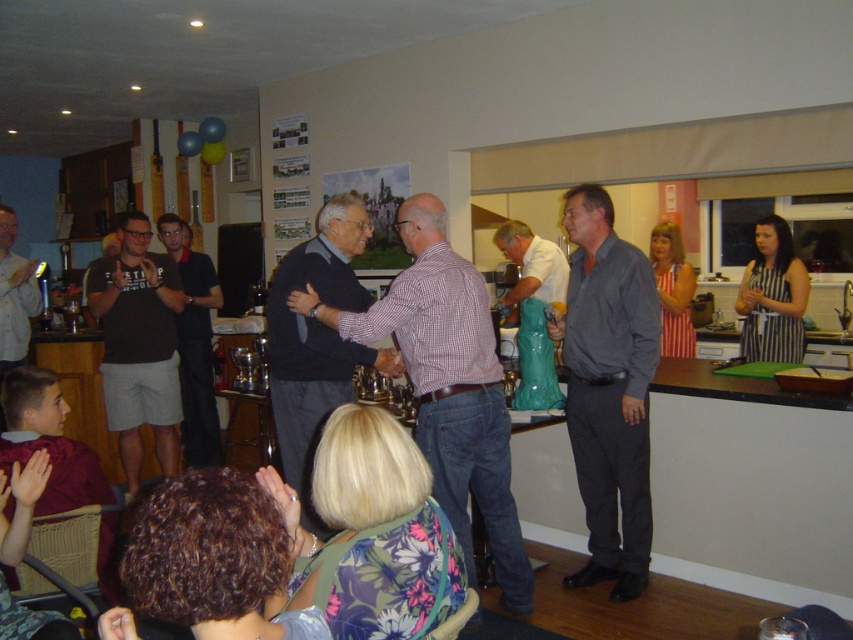
Question: Can you confirm if dark gray sweater at center is positioned below black cotton t-shirt at left?

Choices:
 (A) yes
 (B) no

Answer: (A)

Question: Among these points, which one is farthest from the camera?

Choices:
 (A) (553, 262)
 (B) (624, 314)
 (C) (27, 333)
 (D) (422, 209)

Answer: (C)

Question: From the image, what is the correct spatial relationship of checkered fabric shirt at center in relation to black cotton t-shirt at center?

Choices:
 (A) above
 (B) below

Answer: (B)

Question: Which object is closer to the camera taking this photo?

Choices:
 (A) light brown shirt at lower left
 (B) black cotton t-shirt at center

Answer: (A)

Question: Which point appears farthest from the camera in this image?

Choices:
 (A) (3, 301)
 (B) (612, 483)
 (C) (509, 493)

Answer: (A)

Question: Can you confirm if black cotton t-shirt at left is smaller than light brown shirt at lower left?

Choices:
 (A) yes
 (B) no

Answer: (B)